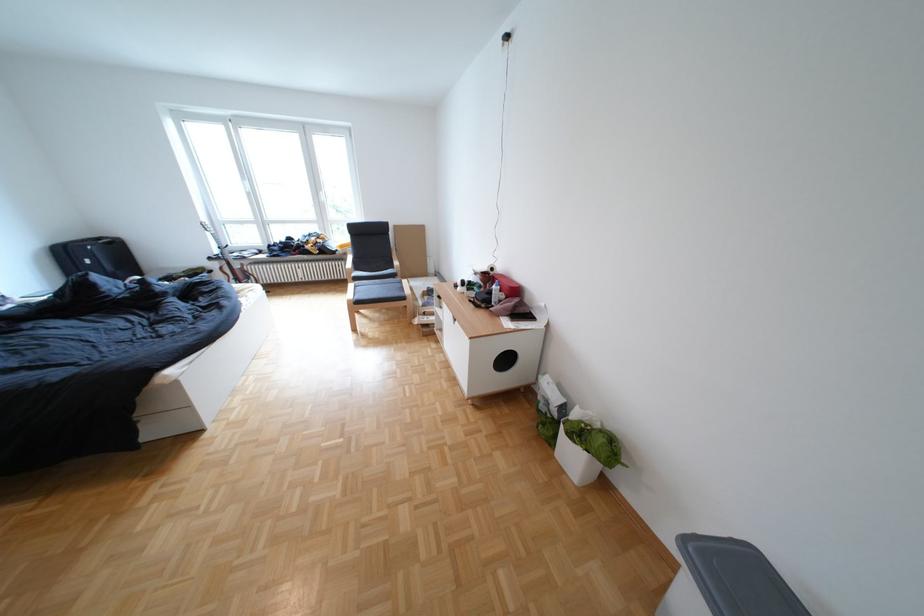
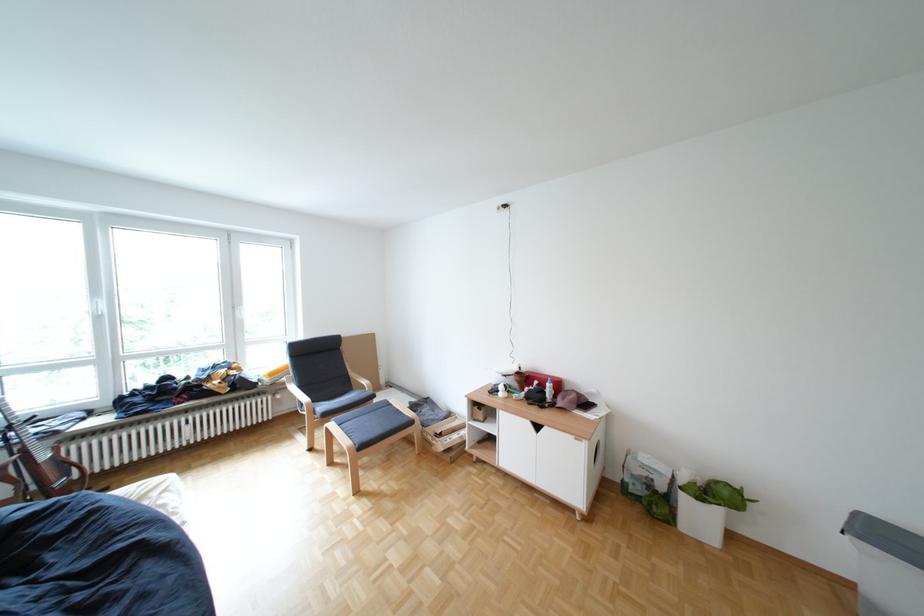
Where in the second image is the point corresponding to (x=264, y=193) from the first image?

(114, 318)